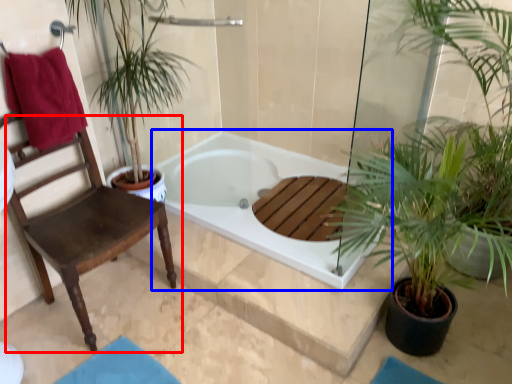
Question: Which object is closer to the camera taking this photo, chair (highlighted by a red box) or bathtub (highlighted by a blue box)?

Choices:
 (A) chair
 (B) bathtub

Answer: (A)